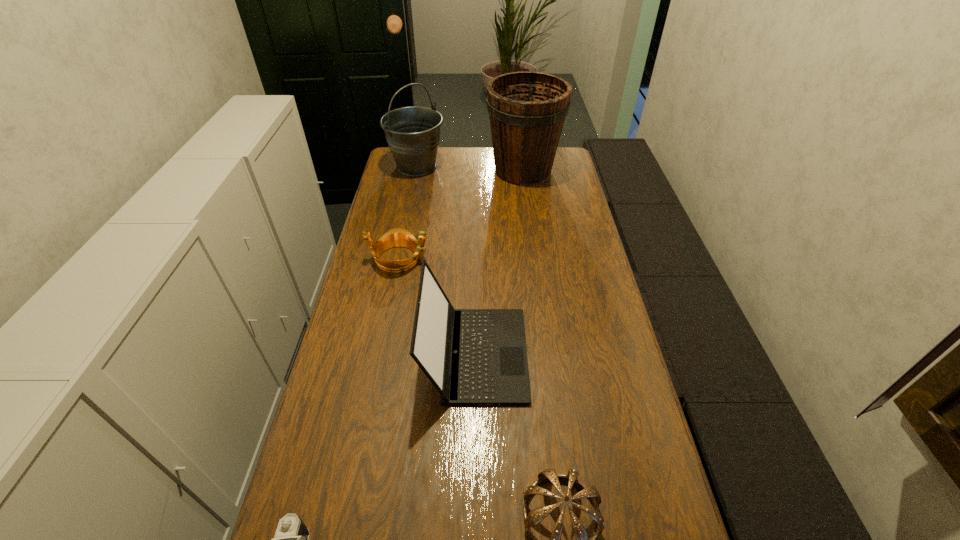
Where is `the right bucket`? This screenshot has width=960, height=540. the right bucket is located at coordinates (527, 110).

Locate an element on the screen. the left bucket is located at coordinates (412, 133).

The width and height of the screenshot is (960, 540). In order to click on laptop in this screenshot , I will do `click(472, 356)`.

You are a GUI agent. You are given a task and a screenshot of the screen. Output one action in this format:
    pyautogui.click(x=<x>, y=<y>)
    Task: Click on the fourth farthest object
    
    Given the screenshot: What is the action you would take?
    pyautogui.click(x=472, y=356)

The width and height of the screenshot is (960, 540). What are the coordinates of `the left tiara` in the screenshot? It's located at (397, 237).

Where is `the farther tiara`? Image resolution: width=960 pixels, height=540 pixels. the farther tiara is located at coordinates (397, 237).

This screenshot has width=960, height=540. In order to click on free space located 0.260m on the front of the right bucket in this screenshot , I will do tap(531, 230).

Locate an element on the screen. vacant region located on the right of the left bucket is located at coordinates (484, 166).

At what (x,y) coordinates should I click in order to perform the action: click on vacant area situated on the surface of the third nearest object. Please return your answer as a coordinate pair (x, y). This screenshot has height=540, width=960. Looking at the image, I should click on (566, 354).

The image size is (960, 540). Identify the location of free region located at the front emblem of the farther tiara. (511, 259).